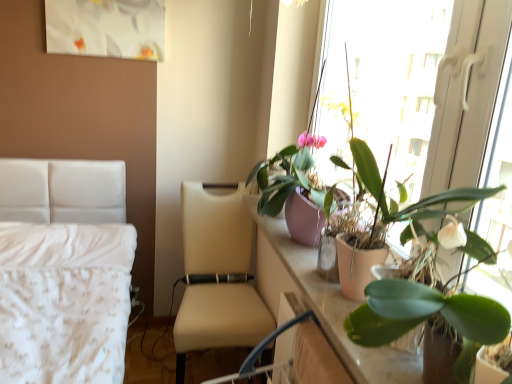
Question: From the image's perspective, is pink matte pot at upper right, which appears as the 2th houseplant when viewed from the top, positioned above or below green matte plant at upper right, which is the third houseplant from top to bottom?

Choices:
 (A) above
 (B) below

Answer: (A)

Question: Does point (306, 155) appear closer or farther from the camera than point (396, 306)?

Choices:
 (A) farther
 (B) closer

Answer: (A)

Question: Considering the real-world distances, which object is farthest from the pink matte pot at upper right, which is the second houseplant in bottom-to-top order?

Choices:
 (A) beige leather chair at center
 (B) green matte plant at upper right, which is the third houseplant from top to bottom
 (C) pink matte plant pot at right
 (D) green matte plant at right, acting as the 3th houseplant starting from the bottom

Answer: (B)

Question: Estimate the real-world distances between objects in this image. Which object is closer to the green matte plant at right, acting as the 3th houseplant starting from the bottom?

Choices:
 (A) pink matte plant pot at right
 (B) beige leather chair at center
 (C) green matte plant at upper right, which is the third houseplant from top to bottom
 (D) pink matte pot at upper right, which is the second houseplant in bottom-to-top order

Answer: (C)